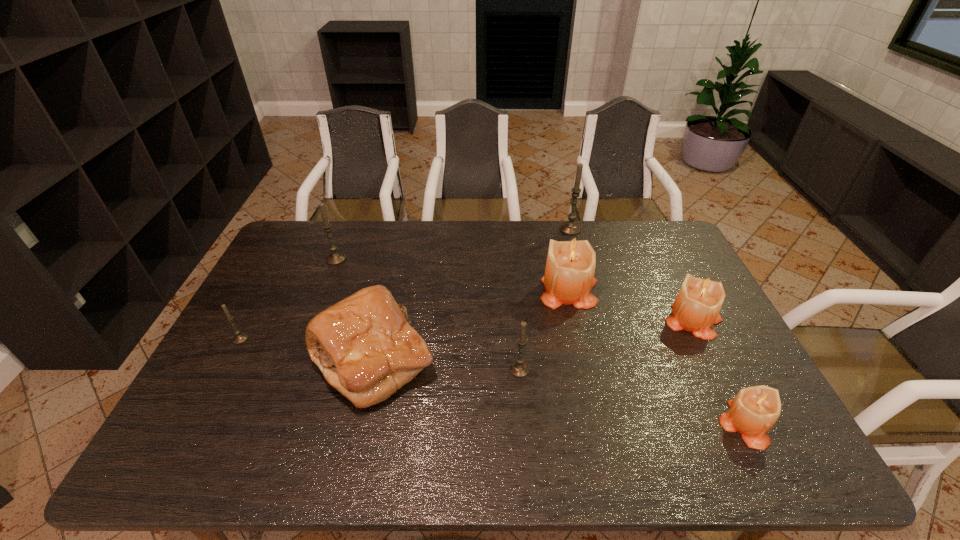
Locate an element on the screen. The image size is (960, 540). the smallest gray candle is located at coordinates (239, 338).

Identify the location of the leftmost gray candle. The height and width of the screenshot is (540, 960). (239, 338).

Image resolution: width=960 pixels, height=540 pixels. What are the coordinates of `the smallest beige candle` in the screenshot? It's located at pyautogui.click(x=753, y=412).

Locate an element on the screen. the nearest beige candle is located at coordinates (753, 412).

Locate an element on the screen. free spot located on the front of the rightmost gray candle is located at coordinates (577, 255).

Where is `vacant space situated on the back of the sixth candle from right to left`? The width and height of the screenshot is (960, 540). vacant space situated on the back of the sixth candle from right to left is located at coordinates (343, 241).

At what (x,y) coordinates should I click in order to perform the action: click on vacant space located on the right of the leftmost beige candle. Please return your answer as a coordinate pair (x, y). Looking at the image, I should click on (672, 289).

The height and width of the screenshot is (540, 960). I want to click on vacant space located on the left of the fifth object from right to left, so click(434, 369).

Identify the location of vacant space located 0.140m on the filling side of the brownish-beige bread. (488, 360).

The image size is (960, 540). I want to click on free space located 0.210m on the front of the second biggest beige candle, so click(736, 406).